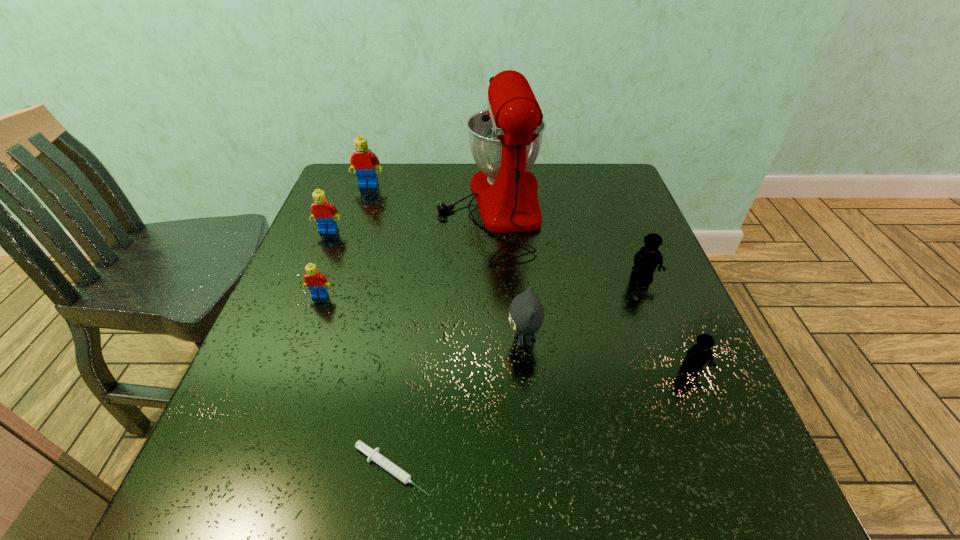
You are a GUI agent. You are given a task and a screenshot of the screen. Output one action in this format:
    pyautogui.click(x=<x>, y=<y>)
    Task: Click on the vacant space located 0.110m on the front-facing side of the farther yellow Lego
    This screenshot has height=540, width=960.
    Given the screenshot: What is the action you would take?
    pyautogui.click(x=660, y=323)

Where is `vacant space located on the front-facing side of the kitten`? This screenshot has width=960, height=540. vacant space located on the front-facing side of the kitten is located at coordinates (361, 340).

Where is `free space located on the front-facing side of the kitten`? Image resolution: width=960 pixels, height=540 pixels. free space located on the front-facing side of the kitten is located at coordinates pyautogui.click(x=366, y=340).

Image resolution: width=960 pixels, height=540 pixels. Find the location of `vacant space located 0.190m on the front-facing side of the kitten`. vacant space located 0.190m on the front-facing side of the kitten is located at coordinates (411, 340).

The width and height of the screenshot is (960, 540). Identify the location of vacant space located on the front-facing side of the smaller yellow Lego. (716, 428).

Where is `vacant space situated on the face of the smallest red Lego`? The height and width of the screenshot is (540, 960). vacant space situated on the face of the smallest red Lego is located at coordinates (258, 463).

At what (x,y) coordinates should I click in order to perform the action: click on vacant space positioned on the back of the syringe. Please return your answer as a coordinate pair (x, y). Looking at the image, I should click on (414, 315).

Image resolution: width=960 pixels, height=540 pixels. Find the location of `mixer at the far edge`. mixer at the far edge is located at coordinates (505, 139).

The width and height of the screenshot is (960, 540). I want to click on Lego situated at the far edge, so click(x=363, y=161).

The width and height of the screenshot is (960, 540). Find the location of `object that is at the near edge`. object that is at the near edge is located at coordinates (373, 455).